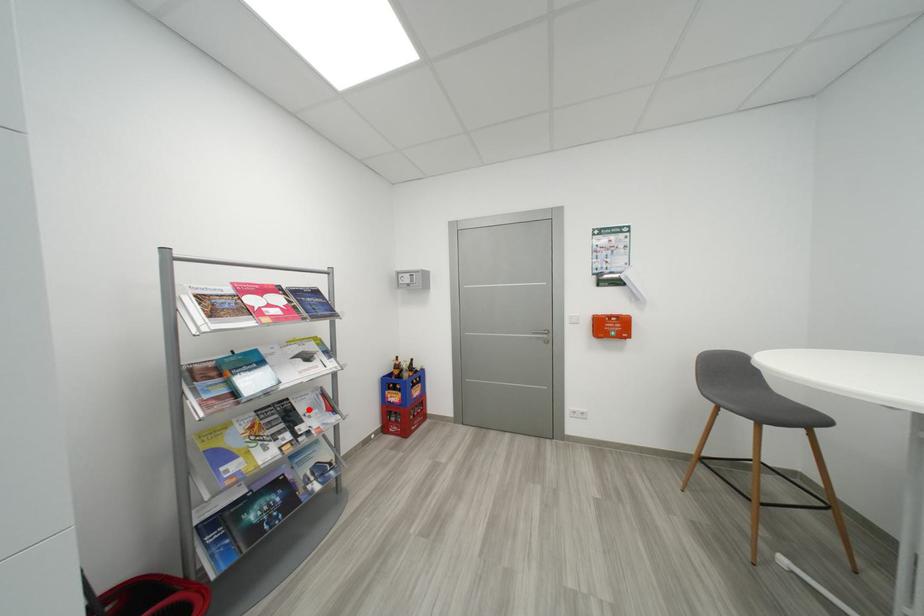
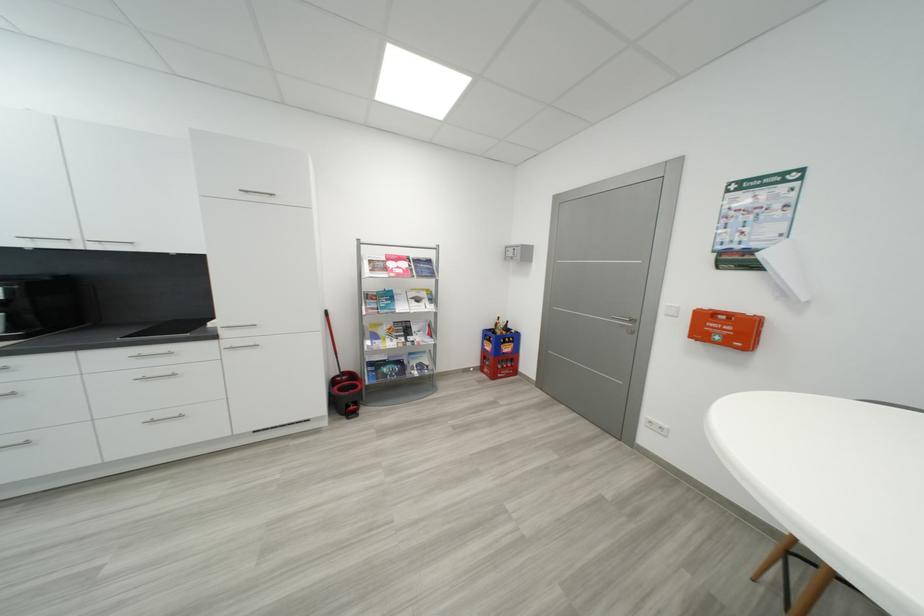
In the second image, find the point that corresponds to the highlighted location in the first image.

(421, 330)